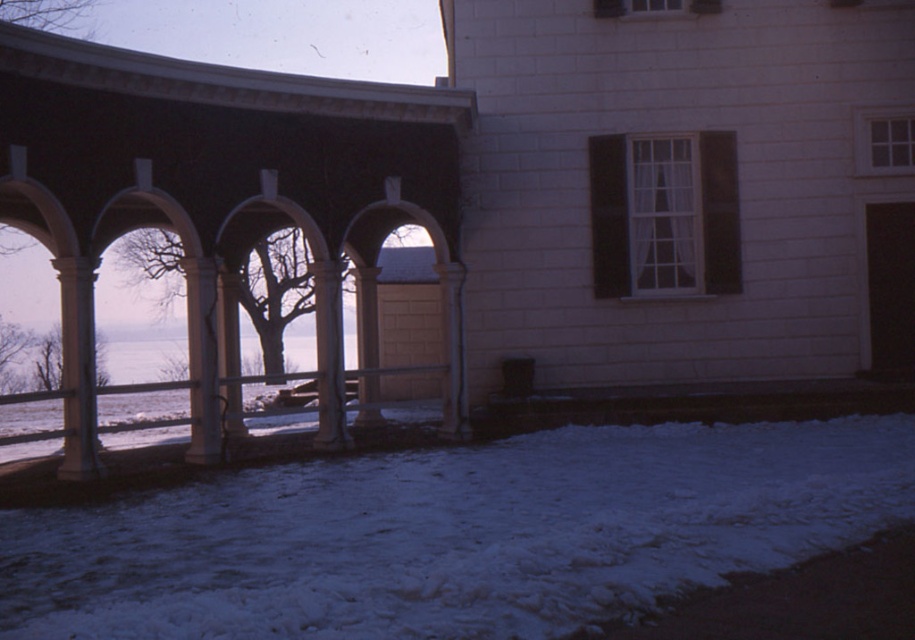
Question: Which object is closer to the camera taking this photo?

Choices:
 (A) white stone archway at left
 (B) bare branches at center

Answer: (A)

Question: Which point is closer to the camera?

Choices:
 (A) (81, 3)
 (B) (504, 616)
 (C) (70, 374)
 (D) (203, 332)

Answer: (B)

Question: Considering the real-world distances, which object is closest to the white glossy column at center?

Choices:
 (A) white stone archway at left
 (B) white fluffy snow at lower center
 (C) white marble pillar at center
 (D) white stone column at center

Answer: (A)

Question: Does white stone column at left appear over white glossy column at center?

Choices:
 (A) no
 (B) yes

Answer: (A)

Question: Does white stone archway at left have a larger size compared to white stone pillar at center?

Choices:
 (A) no
 (B) yes

Answer: (A)

Question: Is white stone column at left positioned in front of white marble pillar at center?

Choices:
 (A) yes
 (B) no

Answer: (A)